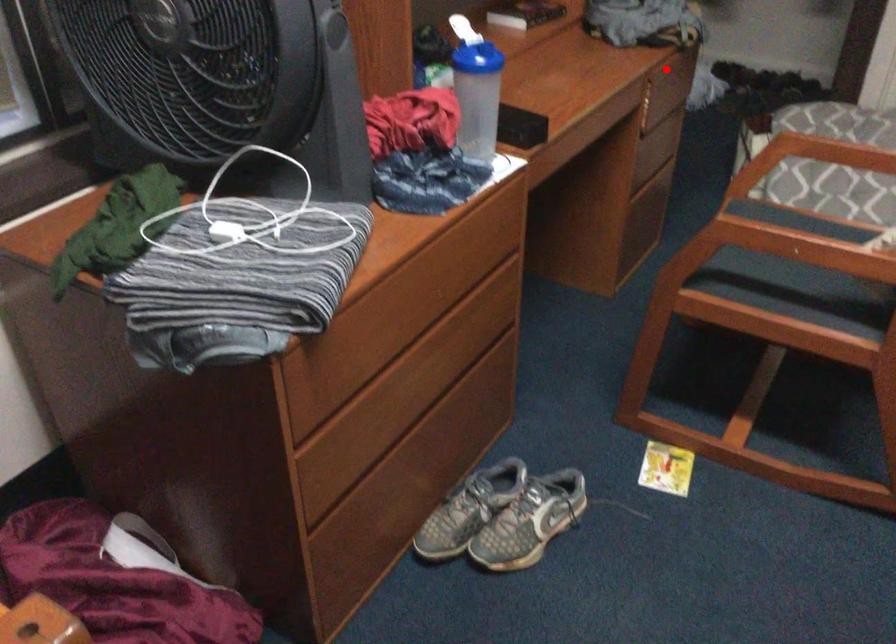
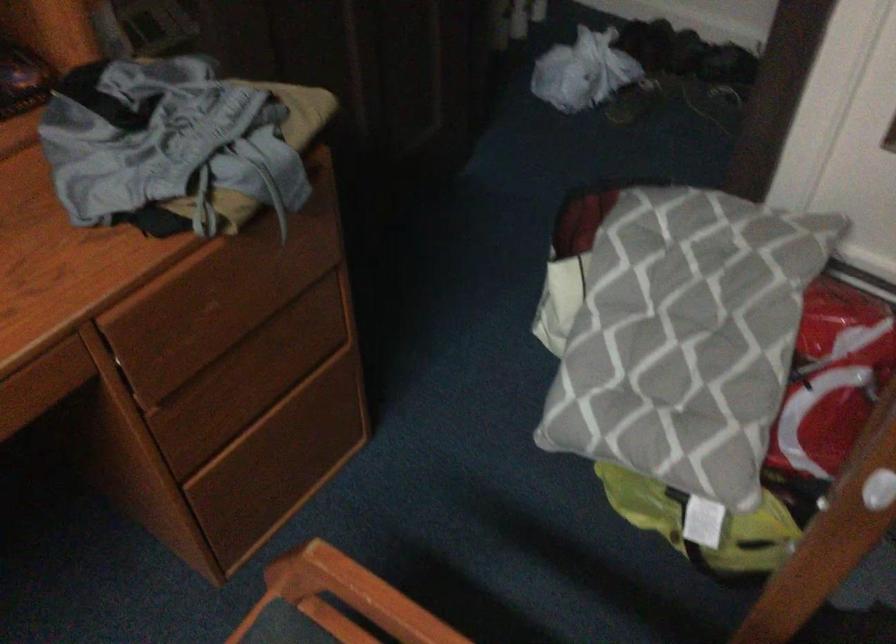
Locate, in the second image, the point that corresponds to the highlighted location in the first image.

(196, 294)